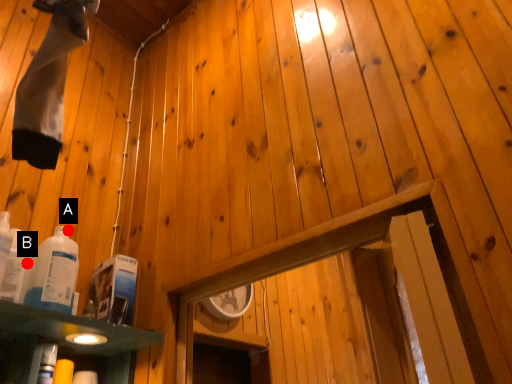
Question: Two points are circled on the image, labeled by A and B beside each circle. Which point is closer to the camera?

Choices:
 (A) A is closer
 (B) B is closer

Answer: (B)